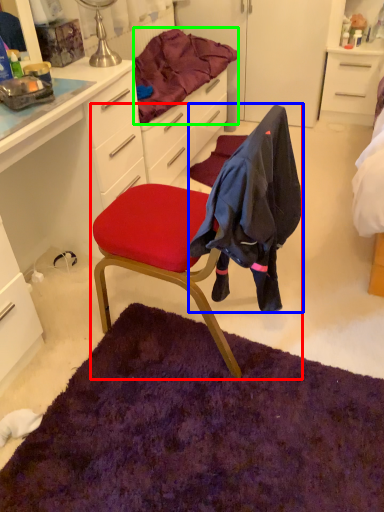
Question: Which object is positioned farthest from chair (highlighted by a red box)? Select from clothing (highlighted by a blue box) and bedding (highlighted by a green box).

Choices:
 (A) clothing
 (B) bedding

Answer: (B)